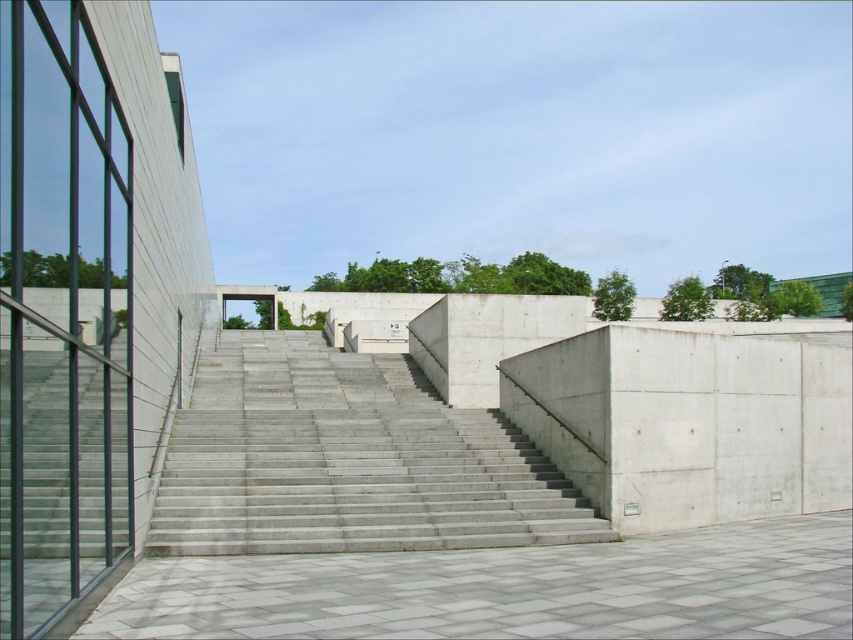
Is gray concrete stairs at center smaller than gray concrete pavement at center?

No, gray concrete stairs at center is not smaller than gray concrete pavement at center.

Is gray concrete stairs at center thinner than gray concrete pavement at center?

Correct, gray concrete stairs at center's width is less than gray concrete pavement at center's.

Is point (364, 513) positioned after point (763, 595)?

Yes, point (364, 513) is farther from viewer.

Locate an element on the screen. gray concrete stairs at center is located at coordinates (347, 460).